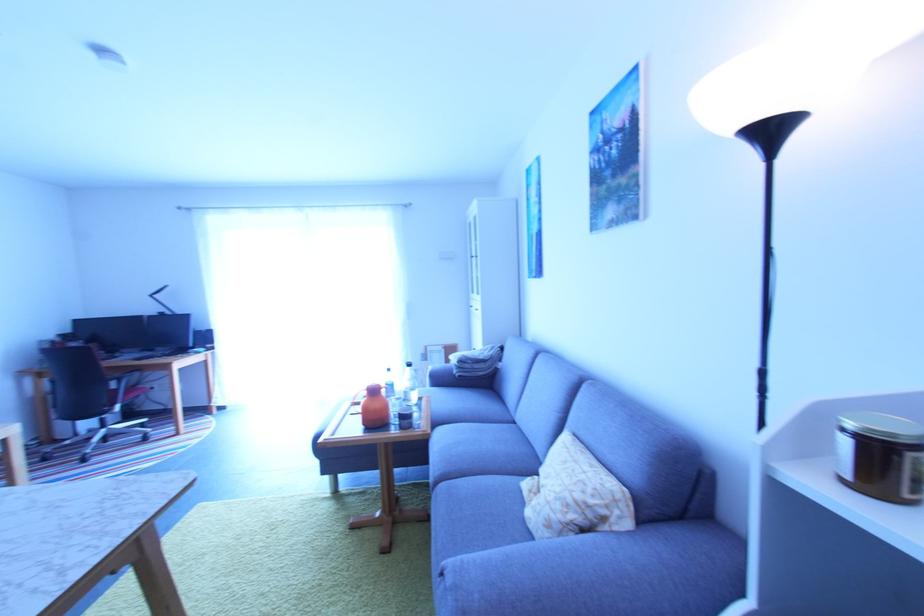
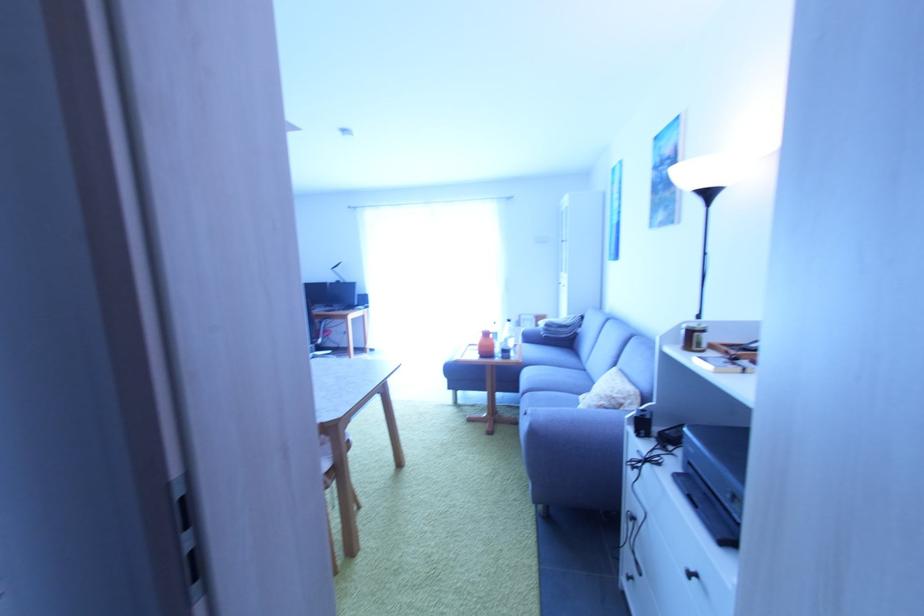
Where in the second image is the point corresponding to (x=379, y=392) from the first image?

(492, 336)